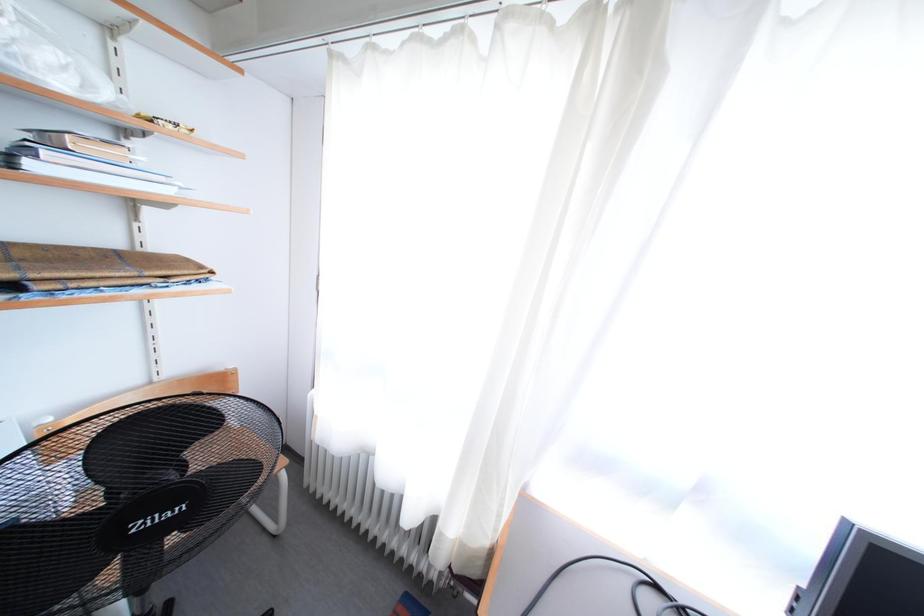
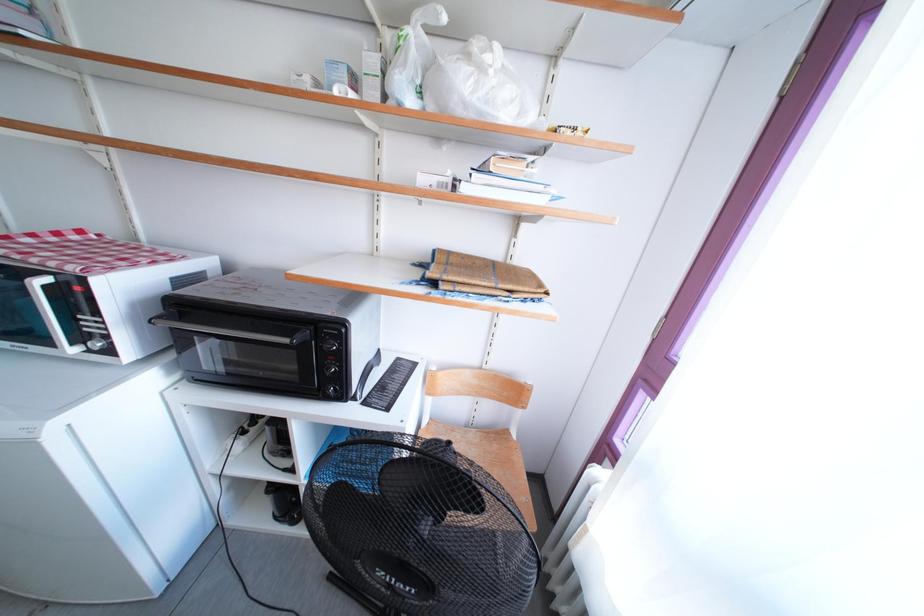
Question: The camera is either moving clockwise (left) or counter-clockwise (right) around the object. The first image is from the beginning of the video and the second image is from the end. Is the camera moving left or right when shooting the video?

Choices:
 (A) Left
 (B) Right

Answer: (B)